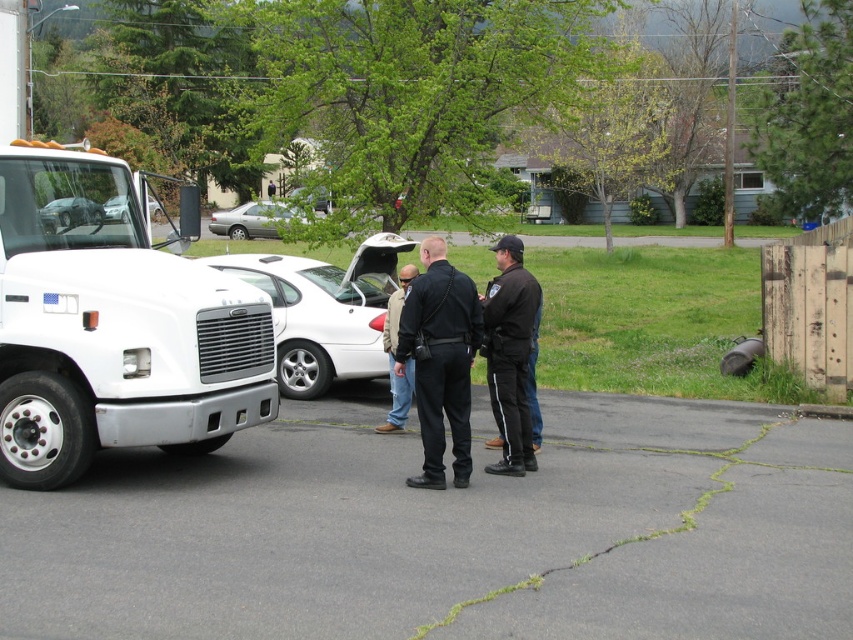
Question: Is black uniform at center above khaki pants at center?

Choices:
 (A) no
 (B) yes

Answer: (A)

Question: Which point is closer to the camera taking this photo?

Choices:
 (A) (397, 316)
 (B) (236, 218)
 (C) (498, 369)
 (D) (175, 310)

Answer: (D)

Question: Which is nearer to the white glossy sedan at center?

Choices:
 (A) silver metallic sedan at center
 (B) black smooth jacket at center

Answer: (B)

Question: Considering the relative positions of white glossy sedan at center and black smooth jacket at center in the image provided, where is white glossy sedan at center located with respect to black smooth jacket at center?

Choices:
 (A) above
 (B) below

Answer: (A)

Question: Among these points, which one is farthest from the camera?

Choices:
 (A) (86, 198)
 (B) (276, 218)
 (C) (431, 381)

Answer: (B)

Question: Does khaki pants at center have a larger size compared to silver metallic sedan at center?

Choices:
 (A) no
 (B) yes

Answer: (A)